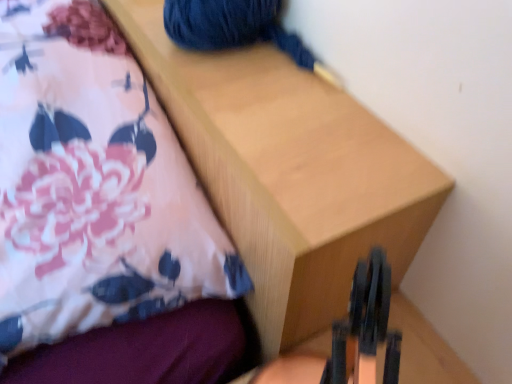
The height and width of the screenshot is (384, 512). I want to click on floral fabric bed at upper left, so click(99, 213).

What do you see at coordinates (99, 213) in the screenshot? I see `floral fabric bed at upper left` at bounding box center [99, 213].

At what (x,y) coordinates should I click in order to perform the action: click on floral fabric bed at upper left. Please return your answer as a coordinate pair (x, y). Looking at the image, I should click on (99, 213).